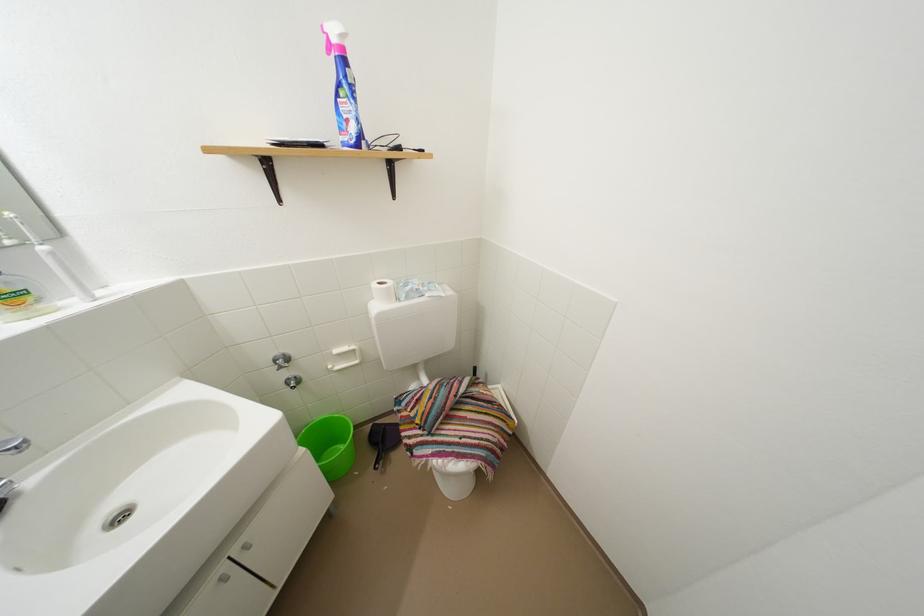
At what (x,y) coordinates should I click in order to perform the action: click on pink spray trigger. Please return your answer as a coordinate pair (x, y). Looking at the image, I should click on (334, 37).